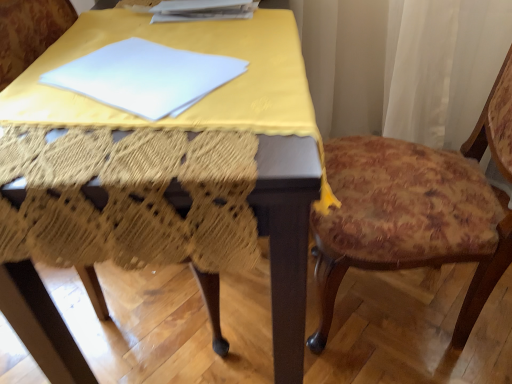
Question: Visually, is white paper at upper center positioned to the left or to the right of yellow fabric-covered table at center?

Choices:
 (A) left
 (B) right

Answer: (B)

Question: Is white paper at upper center in front of or behind yellow fabric-covered table at center in the image?

Choices:
 (A) front
 (B) behind

Answer: (B)

Question: Which object is positioned farthest from the floral fabric cushion at right?

Choices:
 (A) yellow fabric-covered table at center
 (B) white paper at upper center

Answer: (B)

Question: Considering the real-world distances, which object is closest to the yellow fabric-covered table at center?

Choices:
 (A) white paper at upper center
 (B) floral fabric cushion at right

Answer: (A)